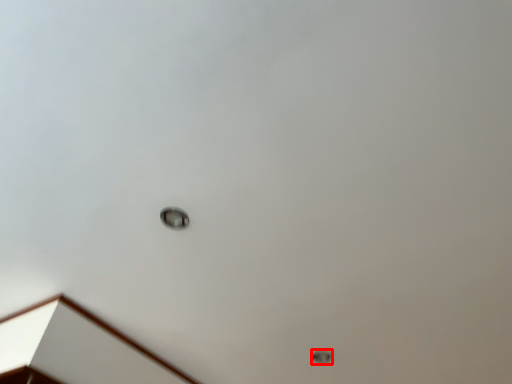
Question: From the image's perspective, where is lamp (annotated by the red box) located relative to dot?

Choices:
 (A) below
 (B) above

Answer: (A)